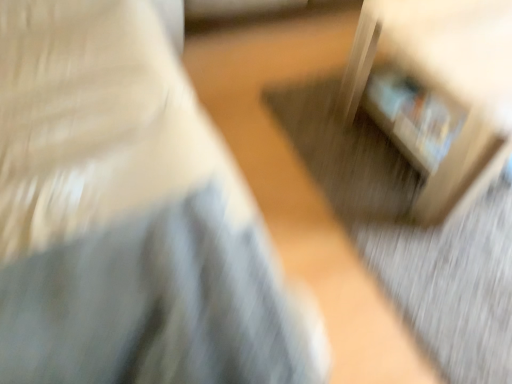
Question: From a real-world perspective, is matte white bookshelf at upper right, which ranks as the 1th furniture in left-to-right order, positioned under wooden crate at lower right, which is counted as the first furniture, starting from the right, based on gravity?

Choices:
 (A) no
 (B) yes

Answer: (A)

Question: Considering the relative sizes of matte white bookshelf at upper right, which ranks as the 1th furniture in left-to-right order, and wooden crate at lower right, arranged as the second furniture when viewed from the left, in the image provided, is matte white bookshelf at upper right, which ranks as the 1th furniture in left-to-right order, shorter than wooden crate at lower right, arranged as the second furniture when viewed from the left,?

Choices:
 (A) no
 (B) yes

Answer: (A)

Question: Does matte white bookshelf at upper right, which ranks as the 1th furniture in left-to-right order, lie behind wooden crate at lower right, arranged as the second furniture when viewed from the left?

Choices:
 (A) yes
 (B) no

Answer: (B)

Question: From a real-world perspective, is matte white bookshelf at upper right, which ranks as the 1th furniture in left-to-right order, physically above wooden crate at lower right, arranged as the second furniture when viewed from the left?

Choices:
 (A) yes
 (B) no

Answer: (A)

Question: Considering the relative sizes of matte white bookshelf at upper right, the 2th furniture from the right, and wooden crate at lower right, which is counted as the first furniture, starting from the right, in the image provided, is matte white bookshelf at upper right, the 2th furniture from the right, smaller than wooden crate at lower right, which is counted as the first furniture, starting from the right,?

Choices:
 (A) no
 (B) yes

Answer: (A)

Question: Can you confirm if matte white bookshelf at upper right, which ranks as the 1th furniture in left-to-right order, is bigger than wooden crate at lower right, which is counted as the first furniture, starting from the right?

Choices:
 (A) no
 (B) yes

Answer: (B)

Question: Does wooden crate at lower right, arranged as the second furniture when viewed from the left, have a larger size compared to matte white bookshelf at upper right, which ranks as the 1th furniture in left-to-right order?

Choices:
 (A) yes
 (B) no

Answer: (B)

Question: Would you say wooden crate at lower right, arranged as the second furniture when viewed from the left, contains matte white bookshelf at upper right, the 2th furniture from the right?

Choices:
 (A) no
 (B) yes

Answer: (A)

Question: From the image's perspective, is wooden crate at lower right, which is counted as the first furniture, starting from the right, beneath matte white bookshelf at upper right, which ranks as the 1th furniture in left-to-right order?

Choices:
 (A) no
 (B) yes

Answer: (B)

Question: Is wooden crate at lower right, which is counted as the first furniture, starting from the right, positioned with its back to matte white bookshelf at upper right, the 2th furniture from the right?

Choices:
 (A) no
 (B) yes

Answer: (A)

Question: Can we say wooden crate at lower right, arranged as the second furniture when viewed from the left, lies outside matte white bookshelf at upper right, the 2th furniture from the right?

Choices:
 (A) no
 (B) yes

Answer: (B)

Question: Considering the relative positions of wooden crate at lower right, arranged as the second furniture when viewed from the left, and matte white bookshelf at upper right, the 2th furniture from the right, in the image provided, is wooden crate at lower right, arranged as the second furniture when viewed from the left, behind matte white bookshelf at upper right, the 2th furniture from the right,?

Choices:
 (A) yes
 (B) no

Answer: (A)

Question: From the image's perspective, relative to wooden crate at lower right, which is counted as the first furniture, starting from the right, is matte white bookshelf at upper right, the 2th furniture from the right, above or below?

Choices:
 (A) below
 (B) above

Answer: (B)